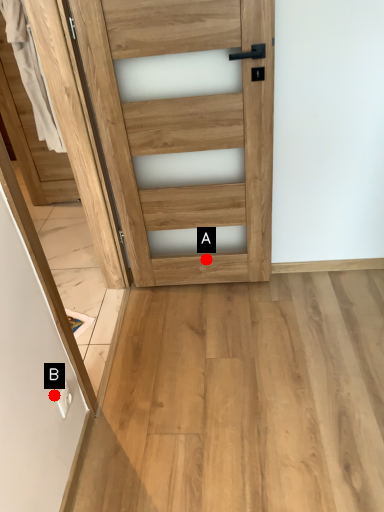
Question: Two points are circled on the image, labeled by A and B beside each circle. Which point is further to the camera?

Choices:
 (A) A is further
 (B) B is further

Answer: (A)